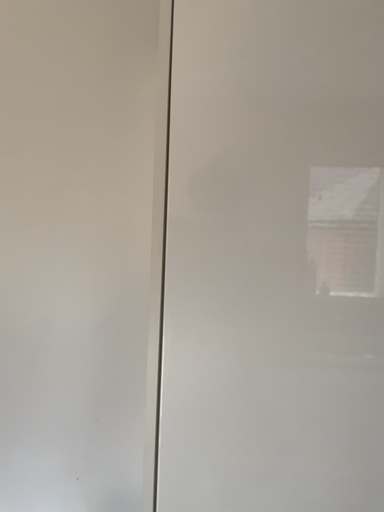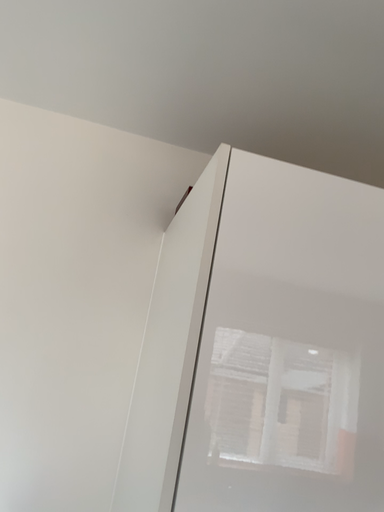
Question: Which way did the camera rotate in the video?

Choices:
 (A) rotated upward
 (B) rotated downward

Answer: (A)